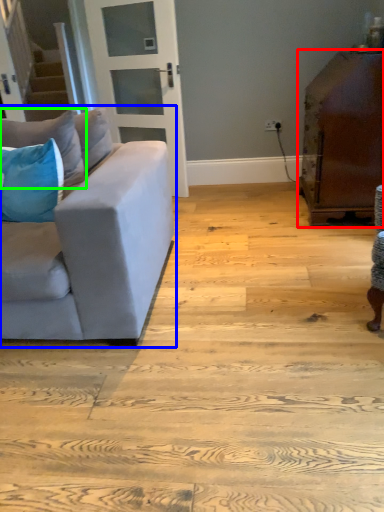
Question: Which object is the closest to the table (highlighted by a red box)? Choose among these: studio couch (highlighted by a blue box) or pillow (highlighted by a green box).

Choices:
 (A) studio couch
 (B) pillow

Answer: (A)